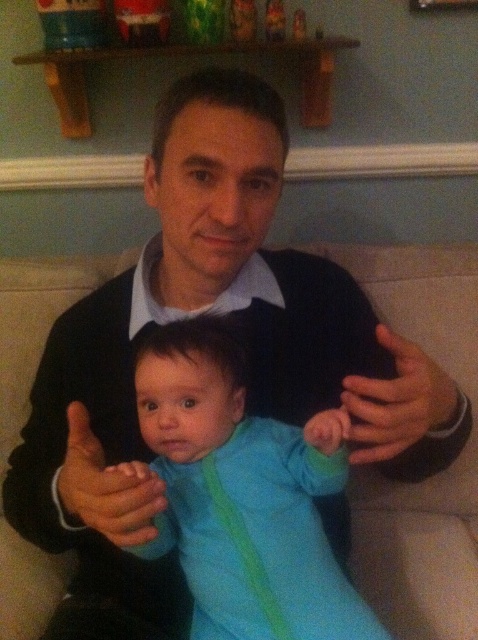
You are a photographer setting up a shoot in the living room. You see the blue fleece onesie at center. Where should you position your camera to capture the onesie in the frame?

To capture the blue fleece onesie at center, position your camera at point 0.775 on the x axis and 0.508 on the y axis.

The man is holding the blue fleece onesie at center. How far apart are they?

The man and the blue fleece onesie at center are 24.53 inches apart.

You are standing in front of the couch and want to place a small toy on the shelf above the man. The shelf has two spots marked by coordinates point (162,516) and point (80,429). Which coordinate is closer to you where you can easily place the toy?

Point (162,516) is further to the camera than point (80,429), so the closer coordinate to you is point (80,429) where you can easily place the toy.